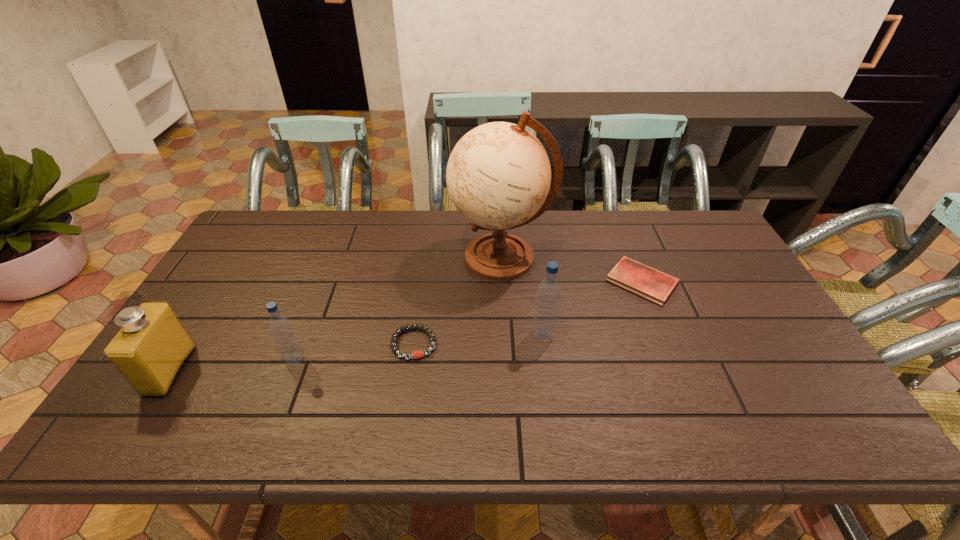
Locate an element on the screen. This screenshot has height=540, width=960. object situated at the near left corner is located at coordinates (151, 348).

Identify the location of vacant space at the far edge of the desktop. The image size is (960, 540). (443, 223).

Find the location of a particular element. This screenshot has width=960, height=540. blank space at the near edge is located at coordinates (420, 383).

In order to click on free space at the left edge of the desktop in this screenshot , I will do `click(244, 303)`.

You are a GUI agent. You are given a task and a screenshot of the screen. Output one action in this format:
    pyautogui.click(x=<x>, y=<y>)
    Task: Click on the free spot at the right edge of the desktop
    
    Given the screenshot: What is the action you would take?
    pyautogui.click(x=765, y=321)

This screenshot has width=960, height=540. What are the coordinates of `free spot between the taller water bottle and the tallest object` in the screenshot? It's located at (522, 296).

You are a GUI agent. You are given a task and a screenshot of the screen. Output one action in this format:
    pyautogui.click(x=<x>, y=<y>)
    Task: Click on the free point between the farther water bottle and the globe
    The image size is (960, 540).
    Given the screenshot: What is the action you would take?
    pyautogui.click(x=522, y=296)

You are a GUI agent. You are given a task and a screenshot of the screen. Output one action in this format:
    pyautogui.click(x=<x>, y=<y>)
    Task: Click on the free space between the rightmost object and the third shortest object
    
    Given the screenshot: What is the action you would take?
    pyautogui.click(x=468, y=321)

Image resolution: width=960 pixels, height=540 pixels. Identify the location of unoccupied position between the bracelet and the tallest object. (457, 301).

This screenshot has width=960, height=540. I want to click on free space that is in between the left water bottle and the bracelet, so click(354, 352).